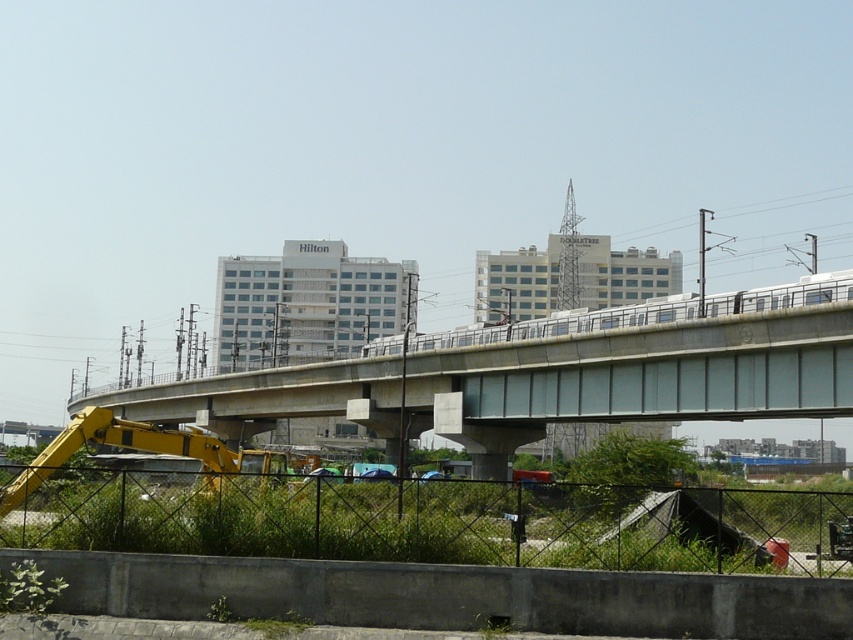
Question: Can you confirm if concrete at center is positioned below silver metallic train at center?

Choices:
 (A) yes
 (B) no

Answer: (A)

Question: Which of the following is the closest to the observer?

Choices:
 (A) (215, 388)
 (B) (488, 332)

Answer: (B)

Question: Which of the following is the farthest from the observer?

Choices:
 (A) silver metallic train at center
 (B) concrete at center

Answer: (A)

Question: Is concrete at center to the left of silver metallic train at center from the viewer's perspective?

Choices:
 (A) yes
 (B) no

Answer: (A)

Question: Can you confirm if concrete at center is thinner than silver metallic train at center?

Choices:
 (A) no
 (B) yes

Answer: (A)